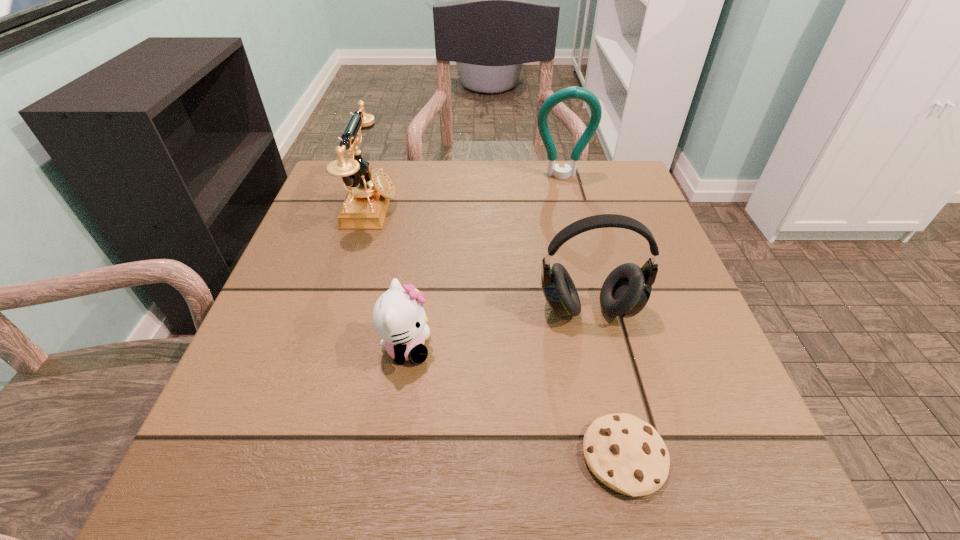
I want to click on object located in the far right corner section of the desktop, so click(x=575, y=92).

Where is `object positioned at the near right corner`? object positioned at the near right corner is located at coordinates (625, 453).

In the image, there is a desktop. Find the location of `free region at the far edge`. free region at the far edge is located at coordinates (518, 203).

In the image, there is a desktop. At what (x,y) coordinates should I click in order to perform the action: click on free region at the near edge. Please return your answer as a coordinate pair (x, y). Looking at the image, I should click on (465, 442).

Locate an element on the screen. This screenshot has height=540, width=960. free space at the left edge of the desktop is located at coordinates pos(313,428).

Where is `free space at the right edge of the desktop`? The width and height of the screenshot is (960, 540). free space at the right edge of the desktop is located at coordinates (686, 391).

This screenshot has height=540, width=960. In order to click on vacant space at the far right corner of the desktop in this screenshot , I will do `click(570, 164)`.

At what (x,y) coordinates should I click in order to perform the action: click on empty location between the cookie and the headset. Please return your answer as a coordinate pair (x, y). Looking at the image, I should click on (607, 383).

Find the location of a particular element. Image resolution: width=960 pixels, height=540 pixels. empty location between the leftmost object and the headset is located at coordinates (480, 258).

Find the location of `free point between the cookie and the headset`. free point between the cookie and the headset is located at coordinates (607, 383).